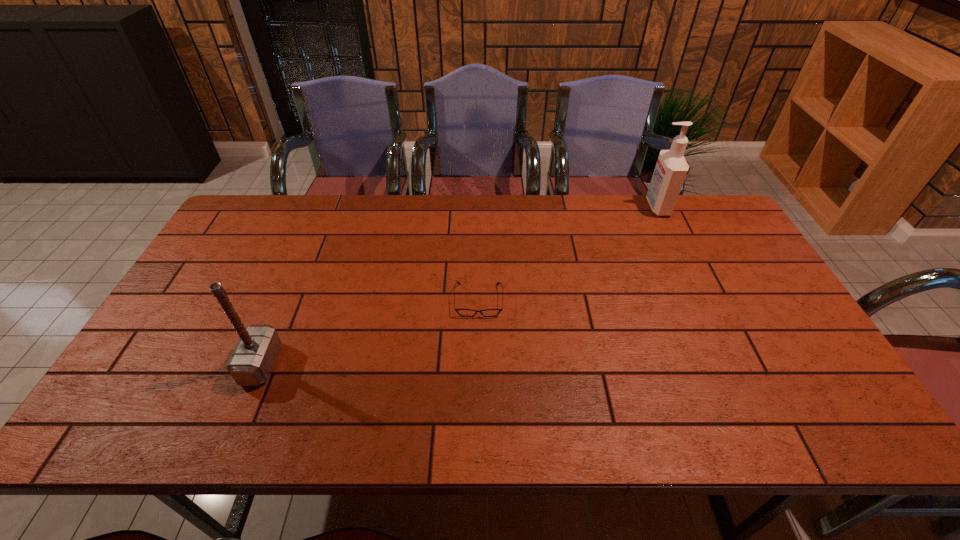
Identify the location of cleansing agent. (671, 168).

You are a GUI agent. You are given a task and a screenshot of the screen. Output one action in this format:
    pyautogui.click(x=<x>, y=<y>)
    Task: Click on the rightmost object
    
    Given the screenshot: What is the action you would take?
    pyautogui.click(x=671, y=168)

You are a GUI agent. You are given a task and a screenshot of the screen. Output one action in this format:
    pyautogui.click(x=<x>, y=<y>)
    Task: Click on the hammer
    Image resolution: width=960 pixels, height=540 pixels.
    Given the screenshot: What is the action you would take?
    pyautogui.click(x=251, y=362)

At what (x,y) coordinates should I click in order to perform the action: click on the nearest object. Please return your answer as a coordinate pair (x, y). This screenshot has height=540, width=960. Looking at the image, I should click on (251, 362).

The height and width of the screenshot is (540, 960). Find the location of `spectacles`. spectacles is located at coordinates (462, 312).

Find the location of a particular element. This screenshot has width=960, height=540. the second farthest object is located at coordinates (462, 312).

The height and width of the screenshot is (540, 960). In order to click on vacant space located 0.360m on the front label of the rightmost object in this screenshot , I will do tap(542, 207).

At what (x,y) coordinates should I click in order to perform the action: click on vacant region located on the front label of the rightmost object. Please return your answer as a coordinate pair (x, y). The width and height of the screenshot is (960, 540). Looking at the image, I should click on (626, 207).

I want to click on free space located 0.180m on the front label of the rightmost object, so click(594, 207).

Identify the location of vacant space located 0.320m on the striking surface of the nearest object. The height and width of the screenshot is (540, 960). (408, 364).